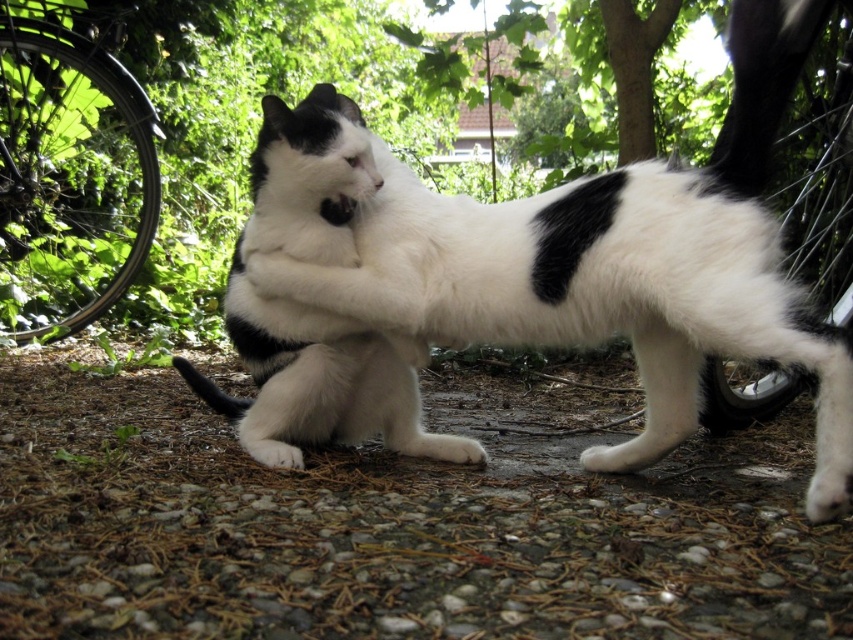
You are a photographer standing in the garden where the black rubber tire at upper left is located. You want to take a closeup photo of the cat without moving the cat. Can you reach the cat from your current position if you are 1.8 meters tall?

The black rubber tire at upper left is 2.20 meters away from the viewer. Since you are 1.8 meters tall, you can reach the cat from your current position as the distance to the tire is greater than your height, allowing you to move closer without obstruction.

You are a photographer trying to capture a photo of the white soft fur cat at center and the black rubber tire at left. Based on their sizes, which object should you focus on first to ensure both are in frame without needing to adjust your camera angle?

The white soft fur cat at center is smaller than the black rubber tire at left, so you should focus on the black rubber tire at left first to ensure both fit in the frame without needing to adjust the camera angle.

You are an animal photographer aiming to capture the cat in the scene. The black rubber tire at upper left is blocking your view. Can you move the tire to the right to get a clear shot of the cat?

The black rubber tire at upper left is located at point (x=68, y=177). Moving it to the right would require knowing its current position, but since the coordinates are provided, you can adjust it accordingly to clear the view.